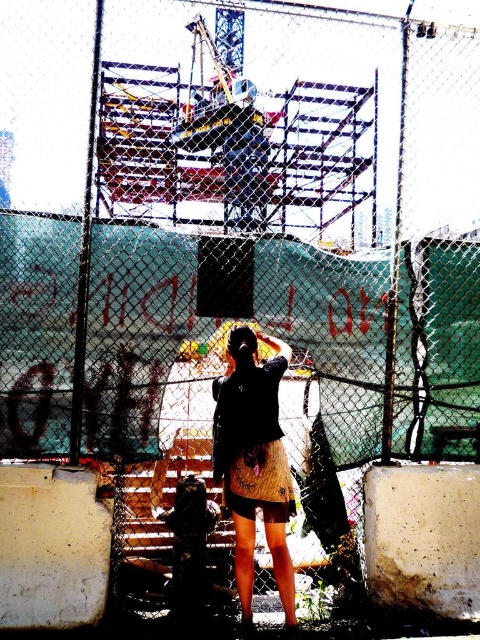
You are a security guard observing the scene through the fence. You notice the matte black shirt at center and the wooden skirt at center. Which item is nearer to you?

The matte black shirt at center is closer to the viewer than the wooden skirt at center.

You are a security guard observing an urban scene through a chain link fence. You notice a person in a matte black shirt at center and a wooden skirt at center. Which clothing item is closer to the fence?

The matte black shirt at center is positioned under the wooden skirt at center, so the matte black shirt at center is closer to the fence.